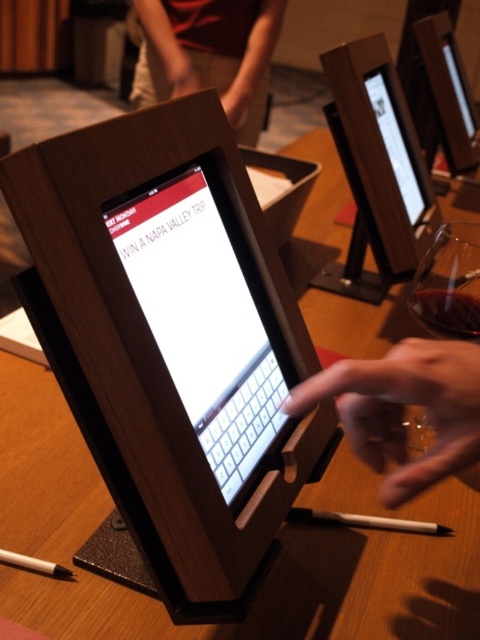
You are standing in front of the wooden tablet kiosk with the touchscreen display. You need to place a small object on the table surface near the transparent glass at right. Where should you place it?

You should place the small object near the transparent glass at right at the 2D location point of (448,284).